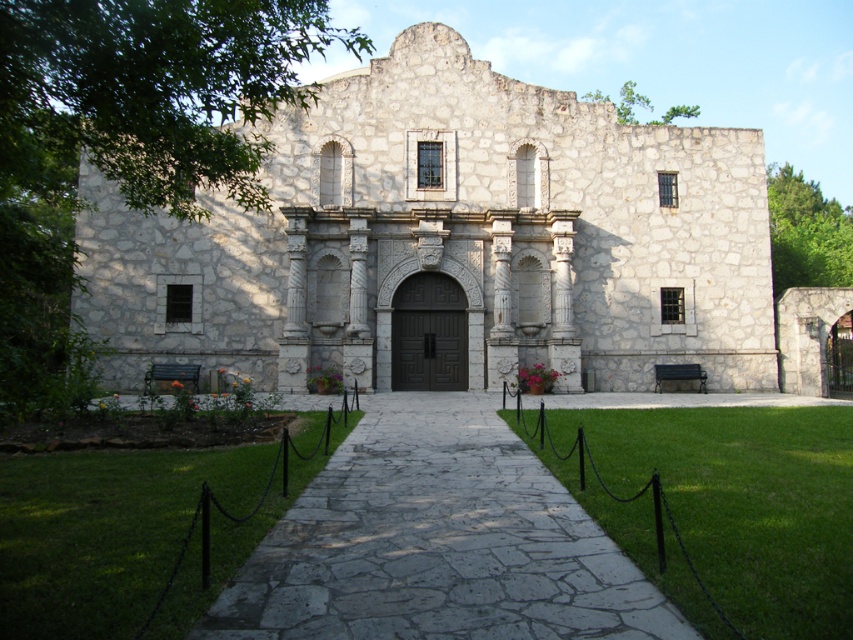
You are standing in front of the historic stone building. You need to walk from the gray stone pathway at center to the stone textured church at center. Is the church wider than the pathway?

The stone textured church at center might be wider than gray stone pathway at center, so it is possible that the church is wider than the pathway.

You are a delivery person with a cart that is 3 meters wide. You need to deliver a package to the dark brown wood door at center. Is the gray stone pathway at center wide enough for your cart to pass through?

The gray stone pathway at center is wider than the dark brown wood door at center, but the description does not provide specific measurements for the pathway or door. Without knowing the exact width of the pathway, it is impossible to determine if the 3 meter wide cart can pass through.